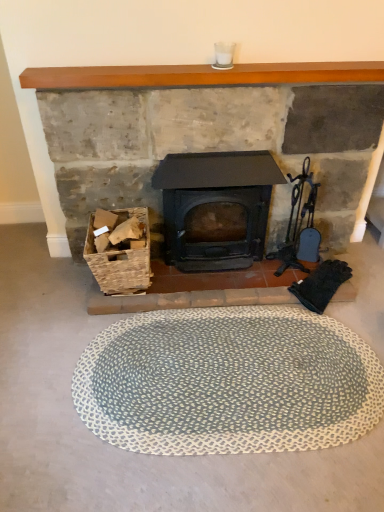
What do you see at coordinates (228, 382) in the screenshot?
I see `blue textured bath mat at center` at bounding box center [228, 382].

The image size is (384, 512). What do you see at coordinates (216, 208) in the screenshot? I see `matte black wood burning stove at center` at bounding box center [216, 208].

Where is `woven wood basket at lower left`? woven wood basket at lower left is located at coordinates [x=121, y=259].

What do you see at coordinates (200, 75) in the screenshot? The height and width of the screenshot is (512, 384). I see `matte black stove at center` at bounding box center [200, 75].

I want to click on blue textured bath mat at center, so click(228, 382).

Is matte black wood burning stove at center facing away from blue textured bath mat at center?

No.

Consider the image. Is matte black wood burning stove at center completely or partially outside of blue textured bath mat at center?

Indeed, matte black wood burning stove at center is completely outside blue textured bath mat at center.

Which object is positioned more to the right, matte black wood burning stove at center or blue textured bath mat at center?

From the viewer's perspective, blue textured bath mat at center appears more on the right side.

Consider the image. What's the angular difference between matte black wood burning stove at center and blue textured bath mat at center's facing directions?

0.316 degrees.

Does matte black wood burning stove at center contain matte black stove at center?

Actually, matte black stove at center is outside matte black wood burning stove at center.

Which is more to the left, matte black wood burning stove at center or matte black stove at center?

From the viewer's perspective, matte black stove at center appears more on the left side.

Considering the points (220, 178) and (305, 63), which point is behind, point (220, 178) or point (305, 63)?

The point (220, 178) is farther from the camera.

In terms of size, does matte black wood burning stove at center appear bigger or smaller than matte black stove at center?

In the image, matte black wood burning stove at center appears to be smaller than matte black stove at center.

Is matte black wood burning stove at center not near wooden mantlepiece at upper center?

No, matte black wood burning stove at center is not far from wooden mantlepiece at upper center.

Can you tell me how much matte black wood burning stove at center and wooden mantlepiece at upper center differ in facing direction?

The angular difference between matte black wood burning stove at center and wooden mantlepiece at upper center is 1.08 degrees.

Which point is more forward, (231, 245) or (191, 69)?

The point (191, 69) is closer to the camera.

From a real-world perspective, is matte black wood burning stove at center physically above wooden mantlepiece at upper center?

No, from a real-world perspective, matte black wood burning stove at center is not on top of wooden mantlepiece at upper center.

Is matte black wood burning stove at center at the right side of woven wood basket at lower left?

Yes, matte black wood burning stove at center is to the right of woven wood basket at lower left.

Which object is closer to the camera, matte black wood burning stove at center or woven wood basket at lower left?

Positioned in front is woven wood basket at lower left.

Find the location of a particular element. The width and height of the screenshot is (384, 512). wood burning stove above the woven wood basket at lower left (from a real-world perspective) is located at coordinates (216, 208).

Which object is thinner, matte black wood burning stove at center or woven wood basket at lower left?

With smaller width is matte black wood burning stove at center.

From the picture: Between blue textured bath mat at center and matte black stove at center, which one appears on the right side from the viewer's perspective?

blue textured bath mat at center is more to the right.

Locate an element on the screen. The image size is (384, 512). fireplace on the left of blue textured bath mat at center is located at coordinates (200, 75).

Measure the distance between blue textured bath mat at center and matte black stove at center.

blue textured bath mat at center is 3.85 feet from matte black stove at center.

Is blue textured bath mat at center inside the boundaries of matte black stove at center, or outside?

blue textured bath mat at center is located beyond the bounds of matte black stove at center.

Would you say wooden mantlepiece at upper center is outside blue textured bath mat at center?

Yes, wooden mantlepiece at upper center is outside of blue textured bath mat at center.

The image size is (384, 512). What are the coordinates of `bath mat below the wooden mantlepiece at upper center (from a real-world perspective)` in the screenshot? It's located at (228, 382).

In the scene shown: Which of these two, wooden mantlepiece at upper center or blue textured bath mat at center, is smaller?

wooden mantlepiece at upper center.

Does wooden mantlepiece at upper center turn towards blue textured bath mat at center?

No, wooden mantlepiece at upper center is not facing towards blue textured bath mat at center.

Does woven wood basket at lower left turn towards wooden mantlepiece at upper center?

No, woven wood basket at lower left is not oriented towards wooden mantlepiece at upper center.

From the image's perspective, does woven wood basket at lower left appear lower than wooden mantlepiece at upper center?

Correct, woven wood basket at lower left appears lower than wooden mantlepiece at upper center in the image.

Does woven wood basket at lower left appear on the right side of wooden mantlepiece at upper center?

Incorrect, woven wood basket at lower left is not on the right side of wooden mantlepiece at upper center.

Considering the sizes of woven wood basket at lower left and wooden mantlepiece at upper center in the image, is woven wood basket at lower left taller or shorter than wooden mantlepiece at upper center?

woven wood basket at lower left is taller than wooden mantlepiece at upper center.

You are a GUI agent. You are given a task and a screenshot of the screen. Output one action in this format:
    pyautogui.click(x=<x>, y=<y>)
    Task: Click on the bath mat that is in front of the matte black wood burning stove at center
    The width and height of the screenshot is (384, 512).
    Given the screenshot: What is the action you would take?
    pyautogui.click(x=228, y=382)

In the image, there is a matte black stove at center. Where is `wood burning stove below it (from the image's perspective)`? This screenshot has width=384, height=512. wood burning stove below it (from the image's perspective) is located at coordinates (216, 208).

When comparing their distances from wooden mantlepiece at upper center, does blue textured bath mat at center or woven wood basket at lower left seem further?

The object further to wooden mantlepiece at upper center is blue textured bath mat at center.

Which object lies nearer to the anchor point blue textured bath mat at center, woven wood basket at lower left or matte black stove at center?

woven wood basket at lower left.

When comparing their distances from matte black wood burning stove at center, does blue textured bath mat at center or matte black stove at center seem further?

Based on the image, blue textured bath mat at center appears to be further to matte black wood burning stove at center.

Looking at the image, which one is located further to matte black stove at center, woven wood basket at lower left or matte black wood burning stove at center?

The object further to matte black stove at center is woven wood basket at lower left.

Looking at the image, which one is located closer to wooden mantlepiece at upper center, blue textured bath mat at center or matte black wood burning stove at center?

Among the two, matte black wood burning stove at center is located nearer to wooden mantlepiece at upper center.

Which object lies nearer to the anchor point matte black stove at center, wooden mantlepiece at upper center or blue textured bath mat at center?

wooden mantlepiece at upper center is positioned closer to the anchor matte black stove at center.

Looking at this image, when comparing their distances from matte black wood burning stove at center, does blue textured bath mat at center or woven wood basket at lower left seem closer?

Among the two, woven wood basket at lower left is located nearer to matte black wood burning stove at center.

Estimate the real-world distances between objects in this image. Which object is closer to blue textured bath mat at center, woven wood basket at lower left or wooden mantlepiece at upper center?

woven wood basket at lower left lies closer to blue textured bath mat at center than the other object.

At what (x,y) coordinates should I click in order to perform the action: click on fireplace that lies between wooden mantlepiece at upper center and woven wood basket at lower left from top to bottom. Please return your answer as a coordinate pair (x, y). This screenshot has width=384, height=512. Looking at the image, I should click on (200, 75).

Identify the location of fireplace between woven wood basket at lower left and matte black wood burning stove at center in the horizontal direction. tap(200, 75).

The image size is (384, 512). Find the location of `basket that lies between matte black wood burning stove at center and blue textured bath mat at center from top to bottom`. basket that lies between matte black wood burning stove at center and blue textured bath mat at center from top to bottom is located at coordinates (121, 259).

Identify the location of basket between matte black stove at center and blue textured bath mat at center vertically. (121, 259).